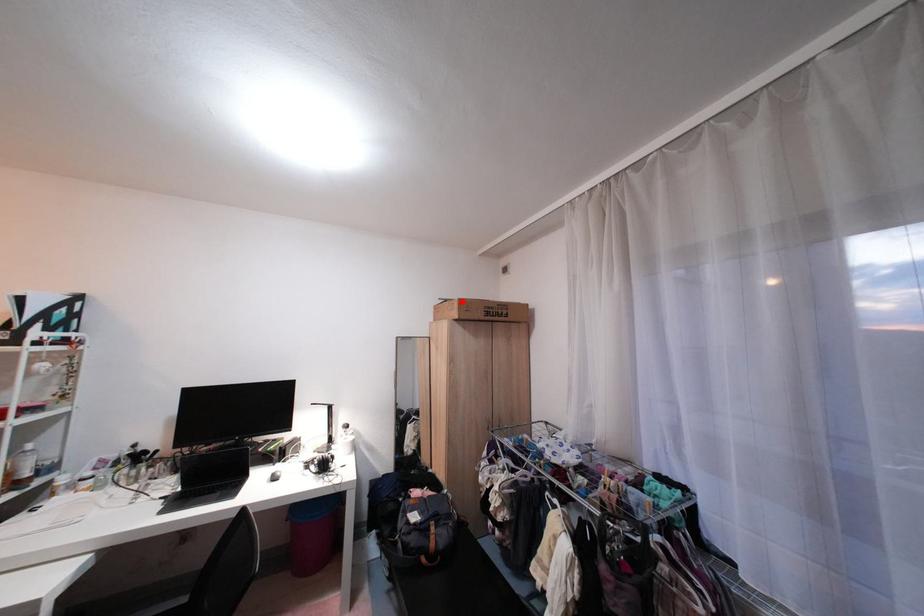
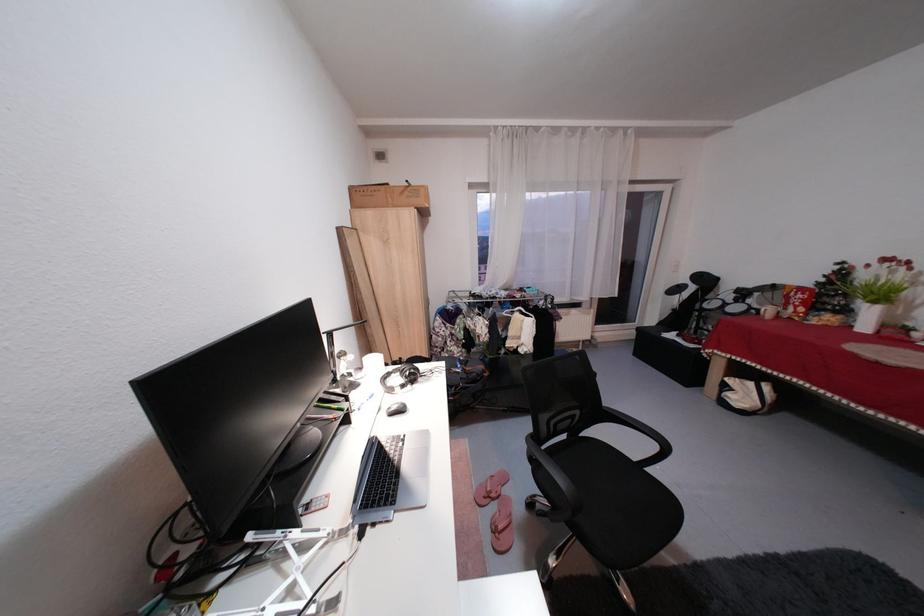
Find the pixel in the second image that matches the highlighted location in the first image.

(420, 185)